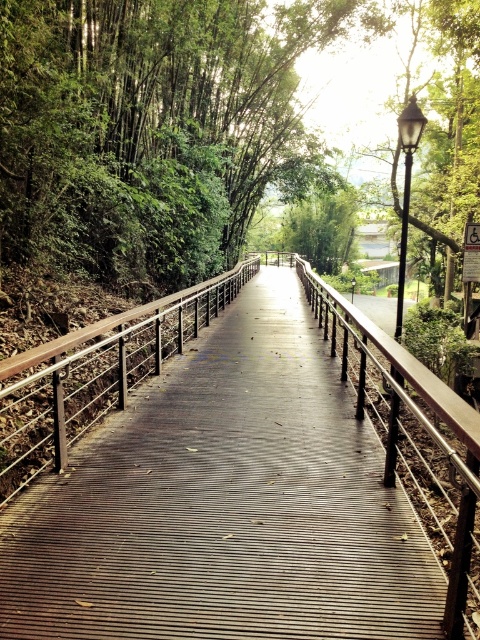
Is point (79, 394) positioned after point (187, 323)?

No, (79, 394) is in front of (187, 323).

Where is `wooden walkway at center`? The image size is (480, 640). wooden walkway at center is located at coordinates (240, 483).

Identify the location of wooden walkway at center. coord(240,483).